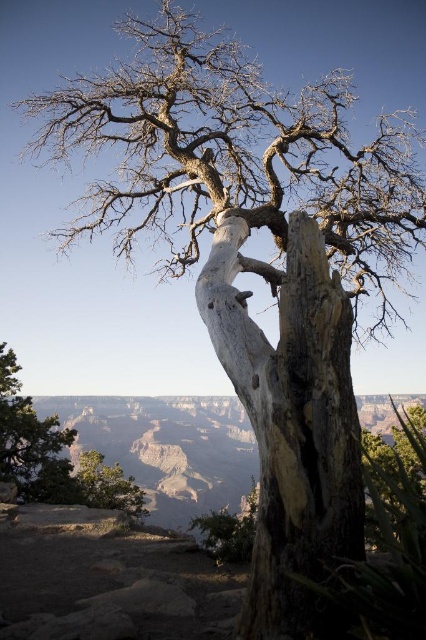
Which is more to the right, white textured bark at center or green rough bark tree at lower left?

white textured bark at center is more to the right.

Can you confirm if white textured bark at center is positioned to the left of green rough bark tree at lower left?

Incorrect, white textured bark at center is not on the left side of green rough bark tree at lower left.

Between point (301, 621) and point (28, 419), which one is positioned in front?

Positioned in front is point (301, 621).

Identify the location of white textured bark at center. (291, 422).